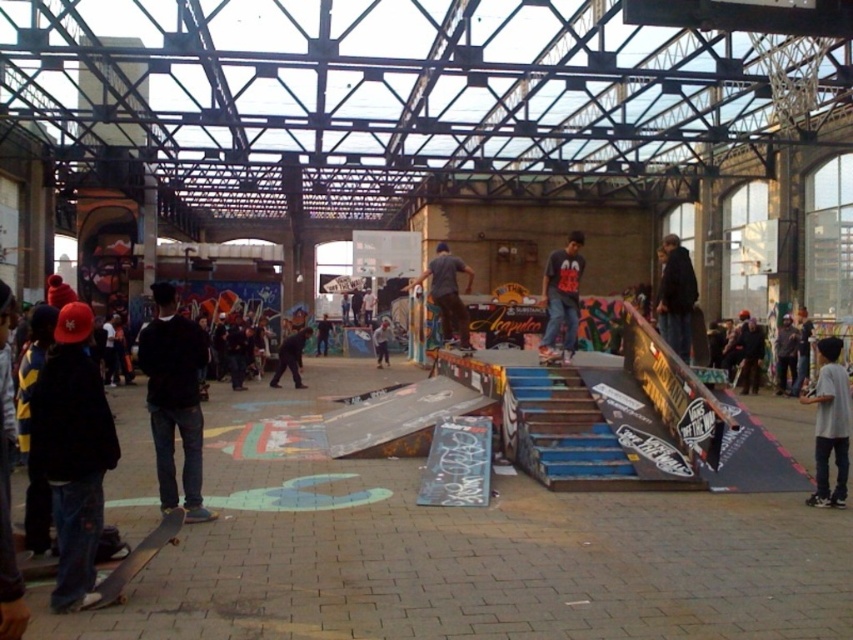
Consider the image. Which is more to the left, dark gray t-shirt at center or dark blue jeans at center?

Positioned to the left is dark gray t-shirt at center.

Can you confirm if dark gray t-shirt at center is shorter than dark blue jeans at center?

Incorrect, dark gray t-shirt at center's height does not fall short of dark blue jeans at center's.

Between point (563, 272) and point (680, 300), which one is positioned in front?

Point (680, 300) is in front.

The width and height of the screenshot is (853, 640). What are the coordinates of `dark gray t-shirt at center` in the screenshot? It's located at (561, 296).

Who is lower down, black matte jacket at center or dark gray shirt at center?

black matte jacket at center is lower down.

Is black matte jacket at center thinner than dark gray shirt at center?

Incorrect, black matte jacket at center's width is not less than dark gray shirt at center's.

You are a GUI agent. You are given a task and a screenshot of the screen. Output one action in this format:
    pyautogui.click(x=<x>, y=<y>)
    Task: Click on the black matte jacket at center
    The image size is (853, 640).
    Given the screenshot: What is the action you would take?
    pyautogui.click(x=173, y=397)

Which of these two, black matte jacket at center or dark gray t-shirt at center, stands taller?

Standing taller between the two is dark gray t-shirt at center.

Image resolution: width=853 pixels, height=640 pixels. Describe the element at coordinates (173, 397) in the screenshot. I see `black matte jacket at center` at that location.

Find the location of a particular element. black matte jacket at center is located at coordinates (173, 397).